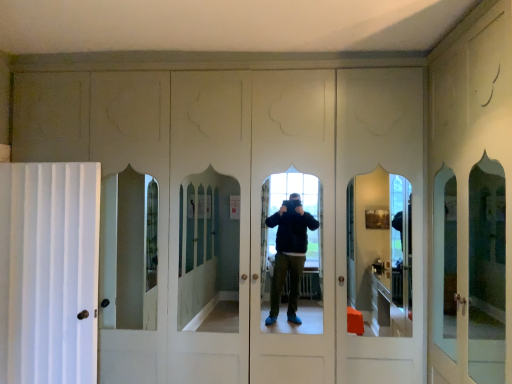
Question: Is white matte screen door at right in front of or behind white fabric curtain at left in the image?

Choices:
 (A) behind
 (B) front

Answer: (B)

Question: From a real-world perspective, relative to white fabric curtain at left, is white matte screen door at right vertically above or below?

Choices:
 (A) above
 (B) below

Answer: (A)

Question: In terms of height, does white matte screen door at right look taller or shorter compared to white fabric curtain at left?

Choices:
 (A) tall
 (B) short

Answer: (A)

Question: Based on their positions, is white fabric curtain at left located to the left or right of white matte screen door at right?

Choices:
 (A) right
 (B) left

Answer: (B)

Question: From a real-world perspective, relative to white matte screen door at right, is white fabric curtain at left vertically above or below?

Choices:
 (A) above
 (B) below

Answer: (B)

Question: From the image's perspective, is white fabric curtain at left above or below white matte screen door at right?

Choices:
 (A) above
 (B) below

Answer: (B)

Question: Is white fabric curtain at left bigger or smaller than white matte screen door at right?

Choices:
 (A) big
 (B) small

Answer: (B)